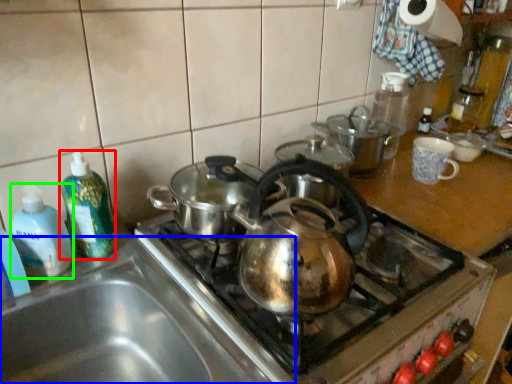
Question: Considering the real-world distances, which object is closest to bottle (highlighted by a red box)? sink (highlighted by a blue box) or bottle (highlighted by a green box).

Choices:
 (A) sink
 (B) bottle

Answer: (B)